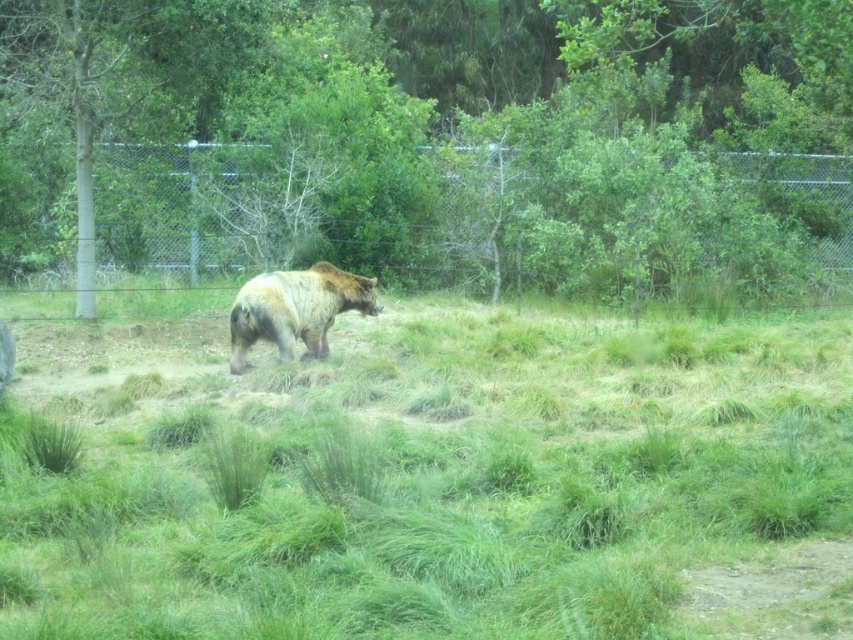
Question: Which object appears closest to the camera in this image?

Choices:
 (A) green grassy at center
 (B) brown furry bear at center

Answer: (A)

Question: Does green grassy at center appear on the left side of brown textured tree at center?

Choices:
 (A) no
 (B) yes

Answer: (B)

Question: Which object appears closest to the camera in this image?

Choices:
 (A) green grassy at center
 (B) brown furry bear at center
 (C) brown textured tree at center

Answer: (A)

Question: Which point is closer to the camera?

Choices:
 (A) brown furry bear at center
 (B) green grassy at center
 (C) brown textured tree at center

Answer: (B)

Question: Considering the relative positions of green grassy at center and brown furry bear at center in the image provided, where is green grassy at center located with respect to brown furry bear at center?

Choices:
 (A) above
 (B) below

Answer: (B)

Question: Does green grassy at center appear on the right side of brown textured tree at center?

Choices:
 (A) yes
 (B) no

Answer: (B)